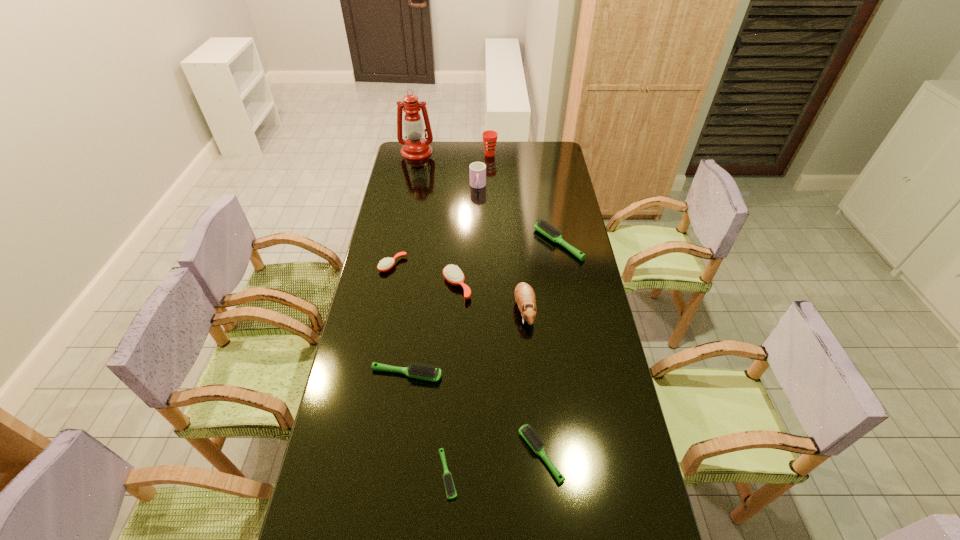
Locate an element on the screen. The height and width of the screenshot is (540, 960). blank area located 0.200m on the front of the third nearest object is located at coordinates tap(397, 447).

Identify the location of vacant space located 0.310m on the right of the left orange hairbrush. This screenshot has height=540, width=960. (484, 265).

What are the coordinates of `vacant space located 0.390m on the left of the second shortest object` in the screenshot? It's located at (380, 455).

Find the location of a particular element. This screenshot has height=540, width=960. free region located 0.090m on the left of the second light hairbrush from left to right is located at coordinates (404, 474).

Identify the location of oil lamp that is at the far edge. The image size is (960, 540). (415, 147).

Image resolution: width=960 pixels, height=540 pixels. Find the location of `cup situated at the far edge`. cup situated at the far edge is located at coordinates (489, 137).

Image resolution: width=960 pixels, height=540 pixels. What are the coordinates of `oil lamp that is at the left edge` in the screenshot? It's located at (415, 147).

Locate an element on the screen. This screenshot has width=960, height=540. object present at the right edge is located at coordinates (541, 226).

The width and height of the screenshot is (960, 540). Find the location of `object that is at the far left corner`. object that is at the far left corner is located at coordinates (415, 147).

Image resolution: width=960 pixels, height=540 pixels. Find the location of `free region at the far edge of the desktop`. free region at the far edge of the desktop is located at coordinates (518, 164).